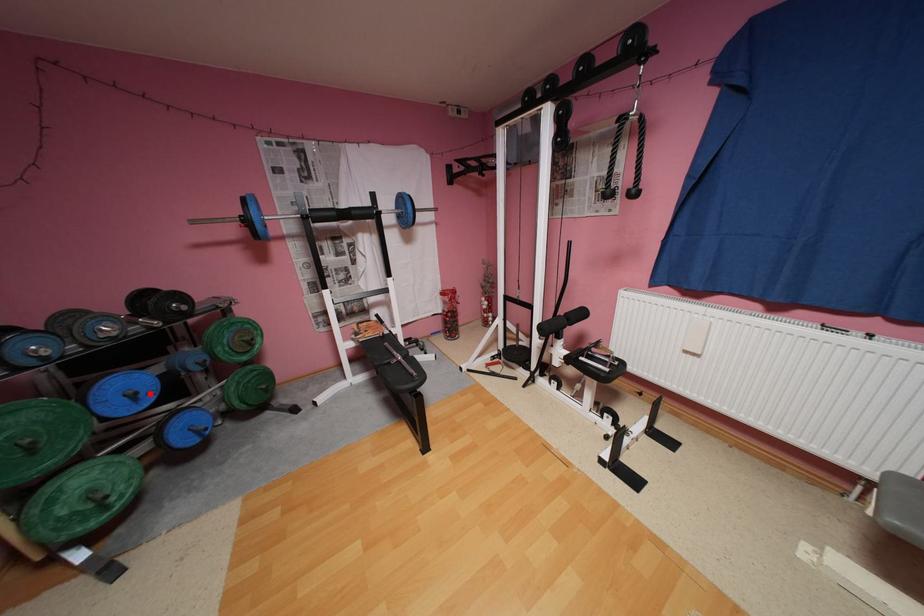
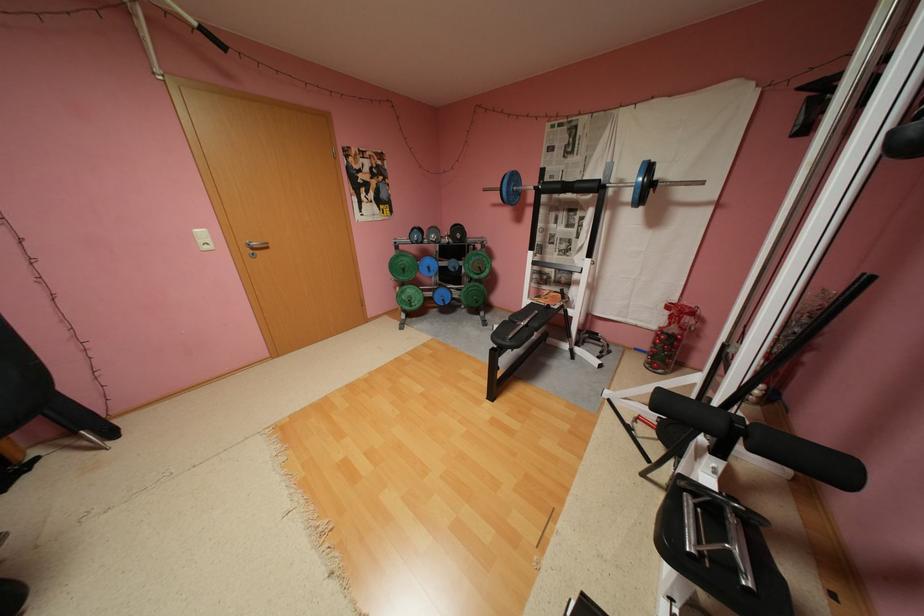
Question: I am providing you with two images of the same scene from different viewpoints. In image1, a red point is highlighted. Considering the same 3D point in image2, which of the following is correct?

Choices:
 (A) It is closer
 (B) It is farther

Answer: (A)